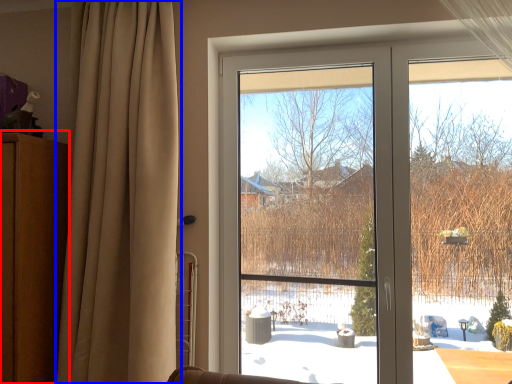
Question: Which point is further to the camera, dresser (highlighted by a red box) or curtain (highlighted by a blue box)?

Choices:
 (A) dresser
 (B) curtain

Answer: (A)